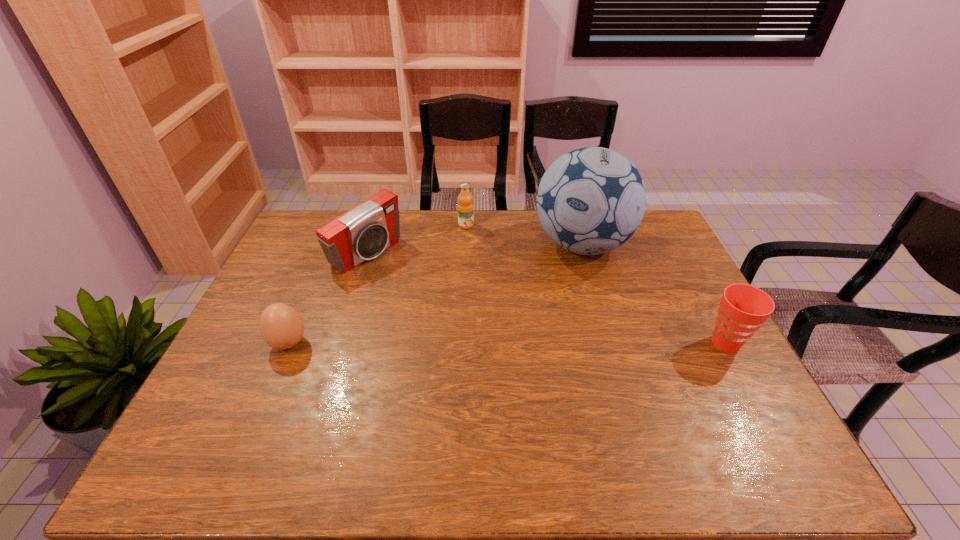
Identify the location of vacant position in the image that satisfies the following two spatial constraints: 1. on the front side of the cup; 2. on the right side of the camera. This screenshot has height=540, width=960. (338, 343).

Image resolution: width=960 pixels, height=540 pixels. Identify the location of free space in the image that satisfies the following two spatial constraints: 1. on the front side of the soccer ball; 2. on the left side of the third object from right to left. (466, 245).

Image resolution: width=960 pixels, height=540 pixels. Identify the location of blank area in the image that satisfies the following two spatial constraints: 1. on the back side of the third object from left to right; 2. on the left side of the camera. pos(375,225).